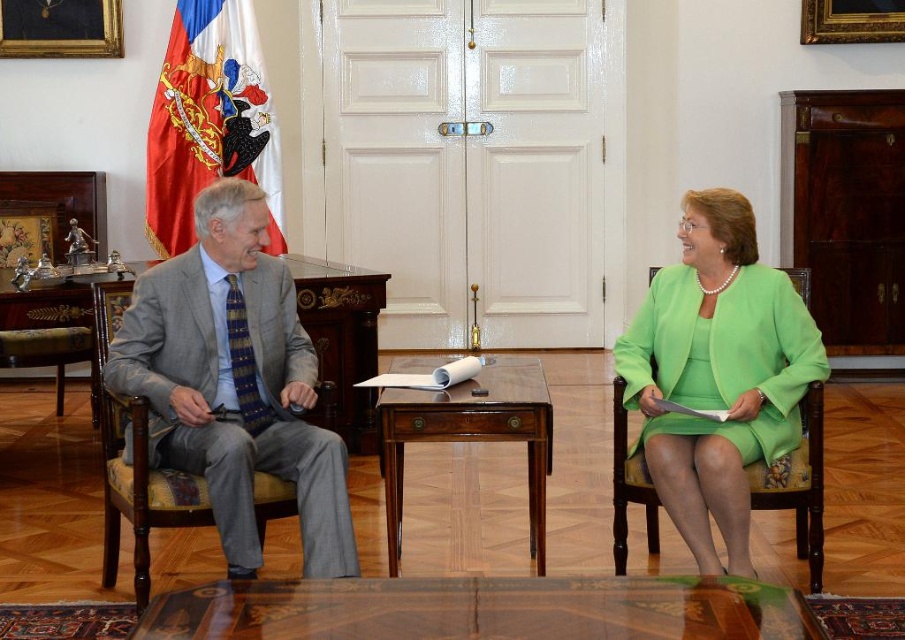
You are a security guard in the room. You need to walk from the red fabric flag at upper left to the mahogany wood table at center. How many steps do you need to take if each step covers 3 feet?

The red fabric flag at upper left is 9.18 feet away from the mahogany wood table at center. Dividing the distance by 3 feet per step gives approximately 3.06 steps. Since you can only take whole steps, you would need to take 4 steps to cover the distance.